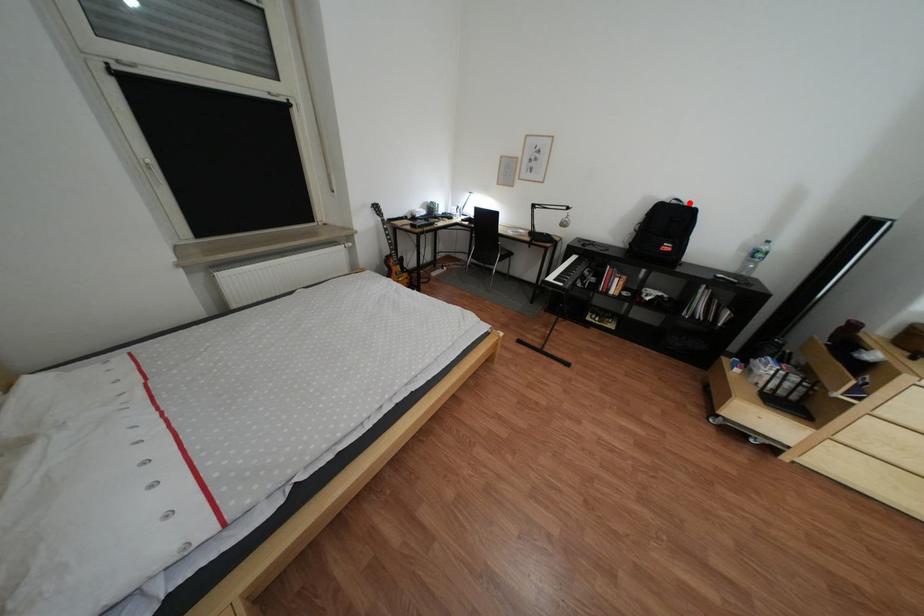
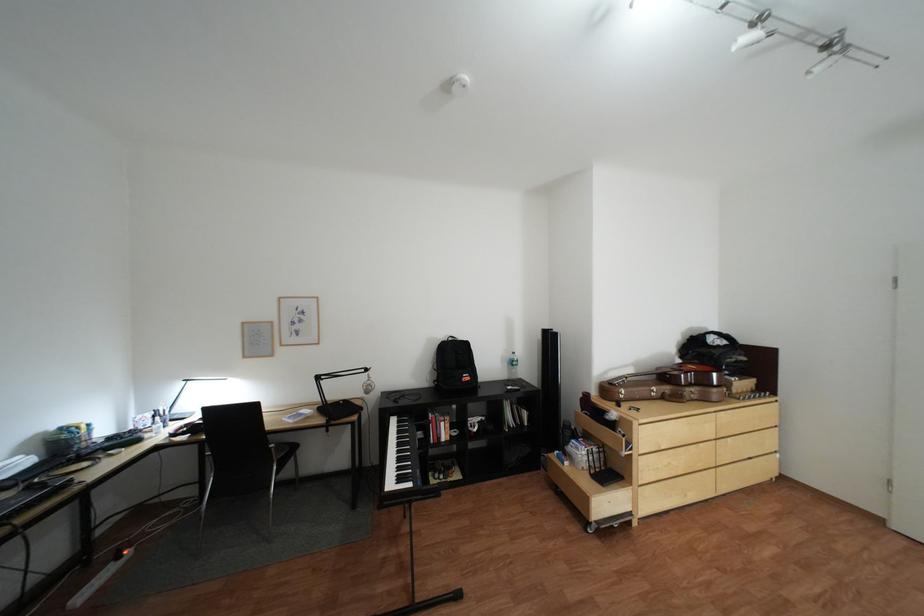
Question: A red point is marked in image1. In image2, is the corresponding 3D point closer to the camera or farther? Reply with the corresponding letter.

Choices:
 (A) The corresponding 3D point is closer.
 (B) The corresponding 3D point is farther.

Answer: (B)